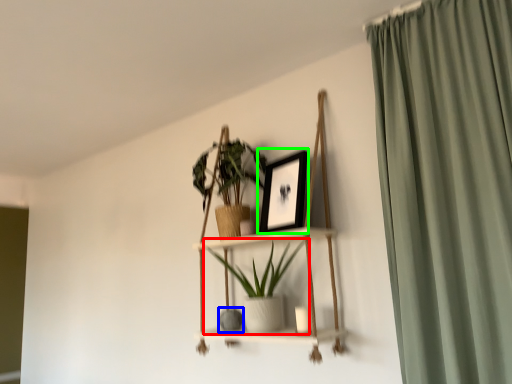
Question: Which is farther away from houseplant (highlighted by a red box)? vase (highlighted by a blue box) or picture frame (highlighted by a green box)?

Choices:
 (A) vase
 (B) picture frame

Answer: (B)